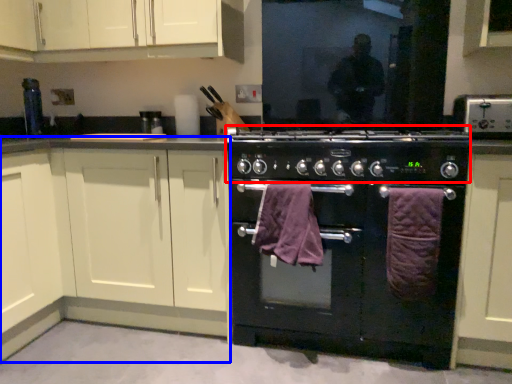
Question: Among these objects, which one is nearest to the camera, appliance (highlighted by a red box) or cabinetry (highlighted by a blue box)?

Choices:
 (A) appliance
 (B) cabinetry

Answer: (A)